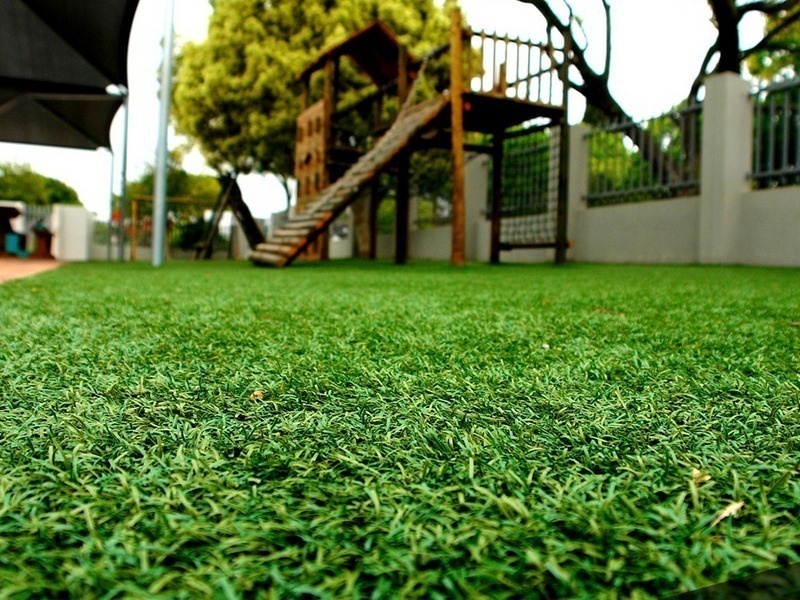
Locate an element on the screen. This screenshot has height=600, width=800. wooden structure is located at coordinates (330, 89).